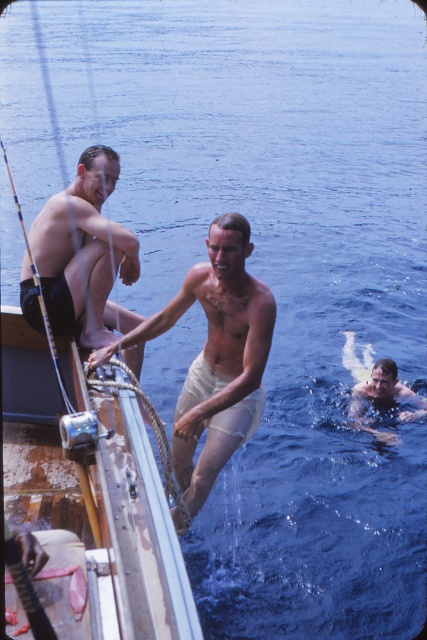
Question: Which object appears farthest from the camera in this image?

Choices:
 (A) tan fabric shorts at center
 (B) wooden boat at left
 (C) smooth skin man at lower right
 (D) matte black shorts at left

Answer: (C)

Question: Does wooden boat at left come in front of tan fabric shorts at center?

Choices:
 (A) no
 (B) yes

Answer: (B)

Question: Does wooden boat at left appear under matte black shorts at left?

Choices:
 (A) yes
 (B) no

Answer: (A)

Question: Is tan fabric shorts at center closer to camera compared to matte black shorts at left?

Choices:
 (A) no
 (B) yes

Answer: (B)

Question: Which of the following is the closest to the observer?

Choices:
 (A) (67, 518)
 (B) (215, 298)

Answer: (A)

Question: Which object is positioned closest to the smooth skin man at lower right?

Choices:
 (A) matte black shorts at left
 (B) wooden boat at left

Answer: (A)